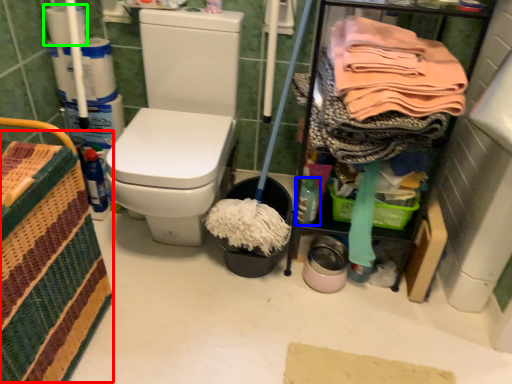
Question: Considering the real-world distances, which object is farthest from basket (highlighted by a red box)? bottle (highlighted by a blue box) or toilet paper (highlighted by a green box)?

Choices:
 (A) bottle
 (B) toilet paper

Answer: (B)